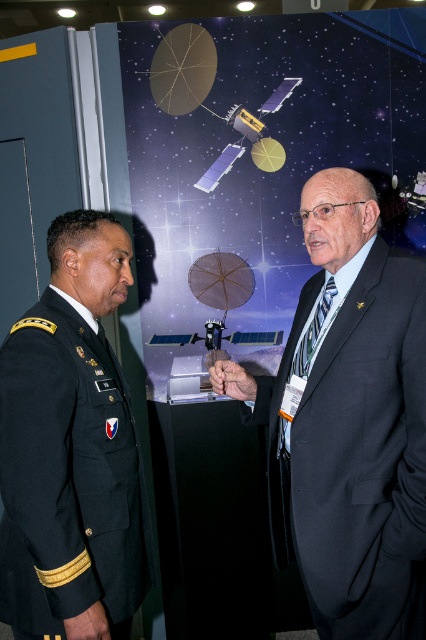
Question: Can you confirm if dark blue suit at center is positioned above dark green military uniform at left?

Choices:
 (A) no
 (B) yes

Answer: (B)

Question: Can you confirm if dark blue suit at center is positioned to the right of smooth skin hand at center?

Choices:
 (A) yes
 (B) no

Answer: (A)

Question: Which object is the closest to the dark green military uniform at left?

Choices:
 (A) dark blue suit at center
 (B) smooth skin hand at center

Answer: (B)

Question: Does dark blue suit at center have a greater width compared to dark green military uniform at left?

Choices:
 (A) no
 (B) yes

Answer: (B)

Question: Which point is farther to the camera?

Choices:
 (A) (385, 488)
 (B) (45, 602)
 (C) (224, 387)

Answer: (C)

Question: Which point is farther to the camera?

Choices:
 (A) dark blue suit at center
 (B) smooth skin hand at center
 (C) dark green military uniform at left

Answer: (B)